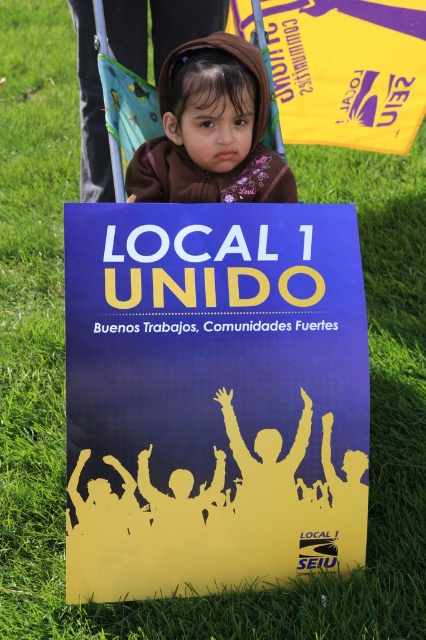
Question: Does blue paper poster at center have a lesser width compared to brown fleece jacket at upper center?

Choices:
 (A) no
 (B) yes

Answer: (A)

Question: Which of the following is the closest to the observer?

Choices:
 (A) tap(189, 451)
 (B) tap(218, 76)

Answer: (A)

Question: Does blue paper poster at center have a smaller size compared to brown fleece jacket at upper center?

Choices:
 (A) yes
 (B) no

Answer: (B)

Question: Is blue paper poster at center to the right of brown fleece jacket at upper center from the viewer's perspective?

Choices:
 (A) yes
 (B) no

Answer: (B)